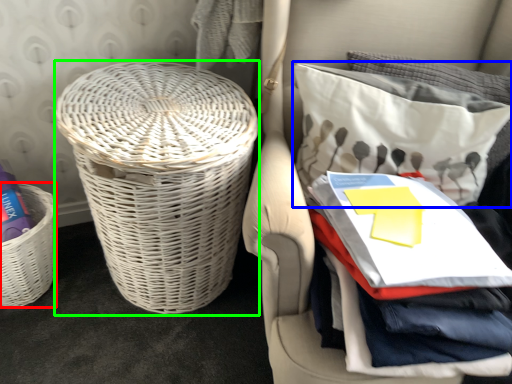
Question: Based on their relative distances, which object is farther from basket (highlighted by a red box)? Choose from pillow (highlighted by a blue box) and basket (highlighted by a green box).

Choices:
 (A) pillow
 (B) basket

Answer: (A)